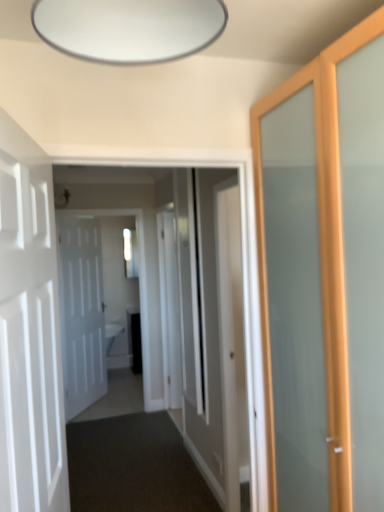
Question: Looking at the image, does white glossy door at center, which is the 1th door in right-to-left order, seem bigger or smaller compared to white matte door at left, the first door when ordered from front to back?

Choices:
 (A) big
 (B) small

Answer: (B)

Question: Does point (223, 320) appear closer or farther from the camera than point (39, 489)?

Choices:
 (A) farther
 (B) closer

Answer: (A)

Question: Which of these objects is positioned farthest from the clear glass door at center?

Choices:
 (A) dark carpet at center, which is counted as the 2th path, starting from the back
 (B) white glossy door at center, marked as the 2th path in a front-to-back arrangement
 (C) white matte door at left, the 1th door positioned from the back
 (D) white glossy door at center
 (E) white glossy door at center, the second door from the back

Answer: (E)

Question: Based on their relative distances, which object is nearer to the white glossy door at center, marked as the 2th path in a front-to-back arrangement?

Choices:
 (A) clear glass door at center
 (B) white matte door at left, which is the 3th door in back-to-front order
 (C) white glossy door at center
 (D) white glossy door at center, which is the 1th door in right-to-left order
 (E) white glossy door at center

Answer: (C)